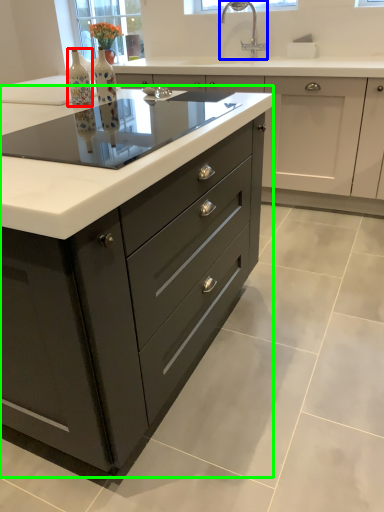
Question: Based on their relative distances, which object is nearer to bottle (highlighted by a red box)? Choose from tap (highlighted by a blue box) and cabinetry (highlighted by a green box).

Choices:
 (A) tap
 (B) cabinetry

Answer: (B)